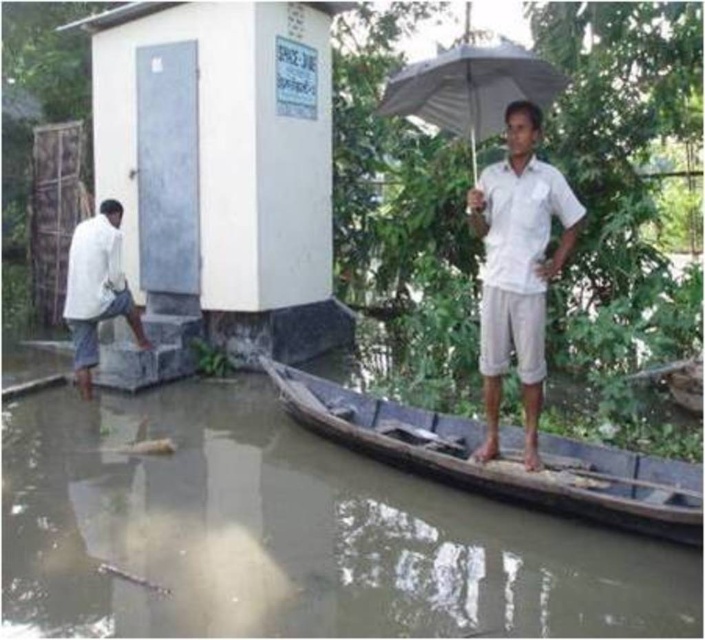
Looking at this image, you are a photographer trying to capture the wooden boat at lower center and the white matte umbrella at upper center in the same frame. Given that the boat is larger, which object should you focus on first to ensure both are clearly visible in your photo?

Since the wooden boat at lower center is larger than the white matte umbrella at upper center, you should focus on the wooden boat at lower center first to ensure both objects are clearly visible in the photo.